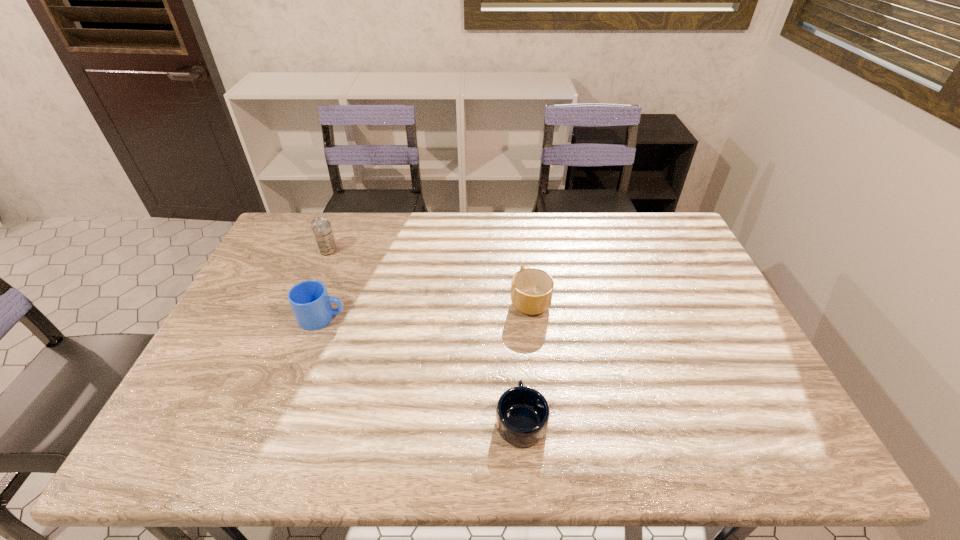
The height and width of the screenshot is (540, 960). I want to click on empty space that is in between the farthest object and the leftmost mug, so click(x=325, y=284).

Locate which object ranks second in proximity to the farthest object. Please provide its 2D coordinates. Your answer should be formatted as a tuple, i.e. [(x, y)], where the tuple contains the x and y coordinates of a point satisfying the conditions above.

[(531, 289)]

Locate which object is the closest to the leftmost mug. Please provide its 2D coordinates. Your answer should be formatted as a tuple, i.e. [(x, y)], where the tuple contains the x and y coordinates of a point satisfying the conditions above.

[(321, 228)]

Where is `mug that stands as the third closest to the beer can`? mug that stands as the third closest to the beer can is located at coordinates tap(522, 414).

Select which mug is the closest to the farthest object. Please provide its 2D coordinates. Your answer should be formatted as a tuple, i.e. [(x, y)], where the tuple contains the x and y coordinates of a point satisfying the conditions above.

[(309, 300)]

You are a GUI agent. You are given a task and a screenshot of the screen. Output one action in this format:
    pyautogui.click(x=<x>, y=<y>)
    Task: Click on the free spot that satisfies the following two spatial constraints: 1. on the side of the leftmost mug with the handle; 2. with the handle on the side of the nearest object
    The height and width of the screenshot is (540, 960).
    Given the screenshot: What is the action you would take?
    286,420